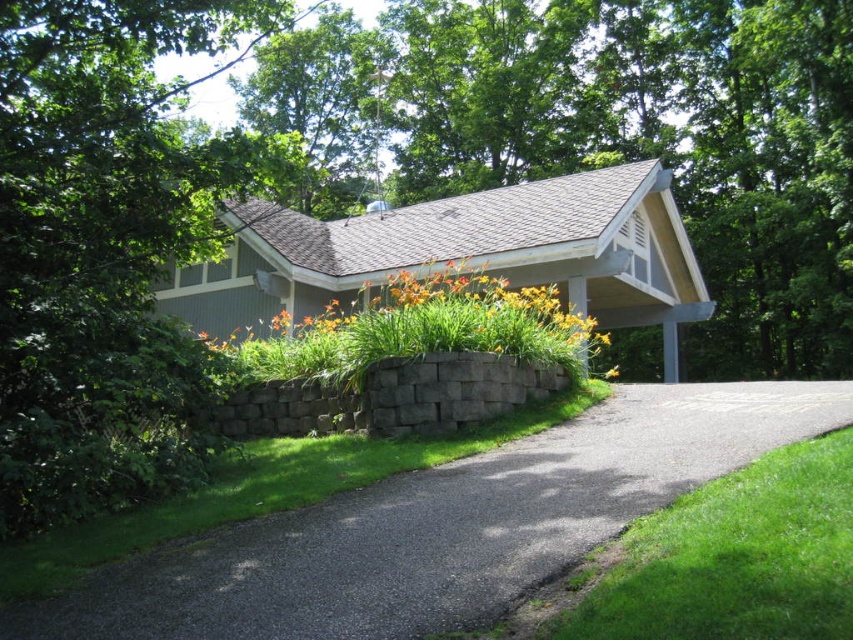
Which is behind, point (86, 157) or point (611, 365)?

Positioned behind is point (611, 365).

The height and width of the screenshot is (640, 853). I want to click on green leafy tree at left, so click(x=107, y=243).

Measure the distance between green leafy tree at left and camera.

The distance of green leafy tree at left from camera is 21.93 feet.

This screenshot has width=853, height=640. In order to click on green leafy tree at left in this screenshot , I will do `click(107, 243)`.

Who is more forward, (364, 296) or (618, 365)?

Point (364, 296) is in front.

Measure the distance between yellow-green leafy plant at center and yellow matte flower at center.

yellow-green leafy plant at center is 16.63 meters from yellow matte flower at center.

Between point (444, 305) and point (616, 369), which one is positioned behind?

The point (616, 369) is more distant.

Locate an element on the screen. Image resolution: width=853 pixels, height=640 pixels. yellow-green leafy plant at center is located at coordinates click(416, 308).

Can you confirm if green leafy tree at left is bigger than yellow-green leafy plant at center?

Yes.

Can you confirm if green leafy tree at left is thinner than yellow-green leafy plant at center?

Incorrect, green leafy tree at left's width is not less than yellow-green leafy plant at center's.

This screenshot has width=853, height=640. In order to click on green leafy tree at left in this screenshot , I will do `click(107, 243)`.